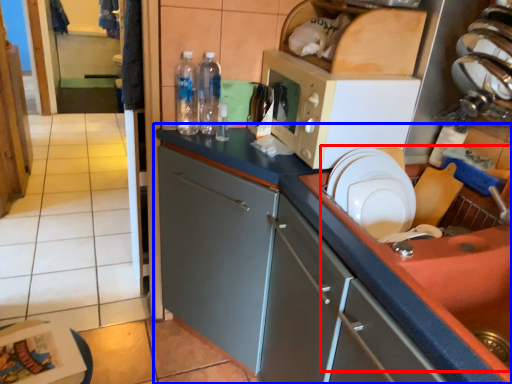
Question: Which point is closer to the camera, sink (highlighted by a red box) or cabinetry (highlighted by a blue box)?

Choices:
 (A) sink
 (B) cabinetry

Answer: (A)